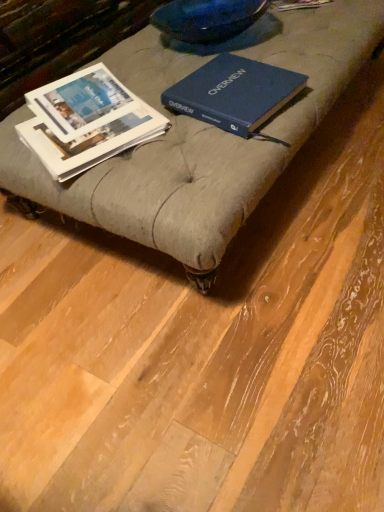
Question: Considering the positions of point (94, 167) and point (215, 91), is point (94, 167) closer or farther from the camera than point (215, 91)?

Choices:
 (A) farther
 (B) closer

Answer: (B)

Question: From a real-world perspective, is matte gray ottoman at center physically located above or below blue hardcover book at center, marked as the 1th book in a right-to-left arrangement?

Choices:
 (A) above
 (B) below

Answer: (B)

Question: Considering the real-world distances, which object is farthest from the white paper book at left, the 2th book viewed from the right?

Choices:
 (A) matte gray ottoman at center
 (B) blue hardcover book at center, the second book when ordered from left to right

Answer: (B)

Question: Which of these objects is positioned farthest from the matte gray ottoman at center?

Choices:
 (A) blue hardcover book at center, marked as the 1th book in a right-to-left arrangement
 (B) white paper book at left, the 2th book viewed from the right

Answer: (B)